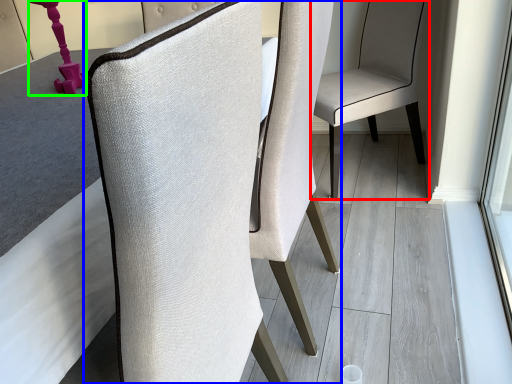
Question: Estimate the real-world distances between objects in this image. Which object is closer to chair (highlighted by a red box), chair (highlighted by a blue box) or table lamp (highlighted by a green box)?

Choices:
 (A) chair
 (B) table lamp

Answer: (A)